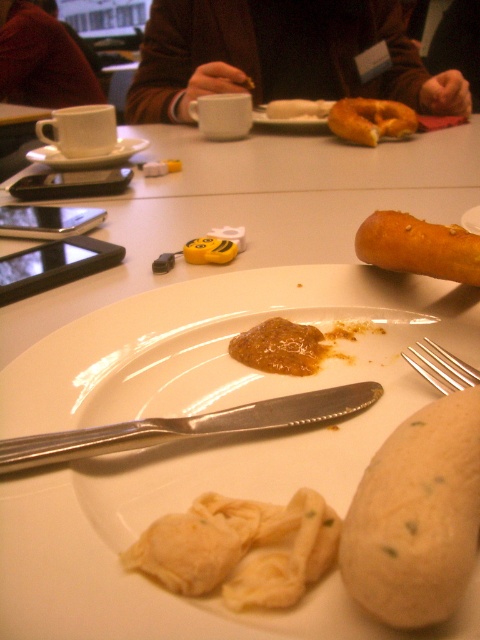
Looking at this image, can you confirm if white matte plate at center is shorter than smooth white bread at center?

No, white matte plate at center is not shorter than smooth white bread at center.

Based on the photo, who is more forward, (7, 481) or (321, 116)?

Point (7, 481) is more forward.

The height and width of the screenshot is (640, 480). I want to click on white matte plate at center, so click(x=204, y=445).

Does point (120, 154) come behind point (290, 106)?

No, it is in front of (290, 106).

Does white ceramic plate at upper center have a greater height compared to smooth white bread at center?

Incorrect, white ceramic plate at upper center's height is not larger of smooth white bread at center's.

Consider the image. Who is more distant from viewer, (x=121, y=150) or (x=297, y=116)?

The point (x=297, y=116) is more distant.

This screenshot has width=480, height=640. In order to click on white ceramic plate at upper center in this screenshot , I will do `click(88, 156)`.

From the picture: Who is positioned more to the right, soft yellow pasta at plate center or brown glossy jam at center?

From the viewer's perspective, brown glossy jam at center appears more on the right side.

Find the location of `soft yellow pasta at plate center`. soft yellow pasta at plate center is located at coordinates (240, 548).

Does point (298, 497) come closer to viewer compared to point (264, 348)?

Yes, point (298, 497) is in front of point (264, 348).

Locate an element on the screen. This screenshot has height=640, width=480. soft yellow pasta at plate center is located at coordinates (240, 548).